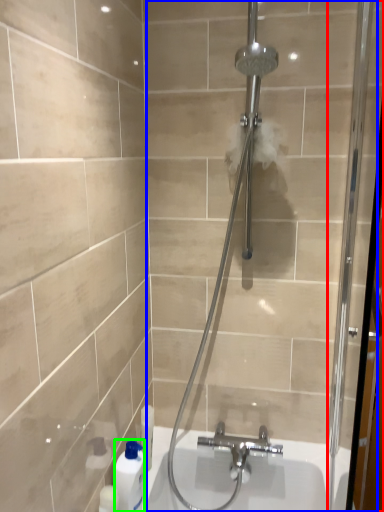
Question: Based on their relative distances, which object is farther from screen door (highlighted by a red box)? Choose from shower door (highlighted by a blue box) and cleaning product (highlighted by a green box).

Choices:
 (A) shower door
 (B) cleaning product

Answer: (B)